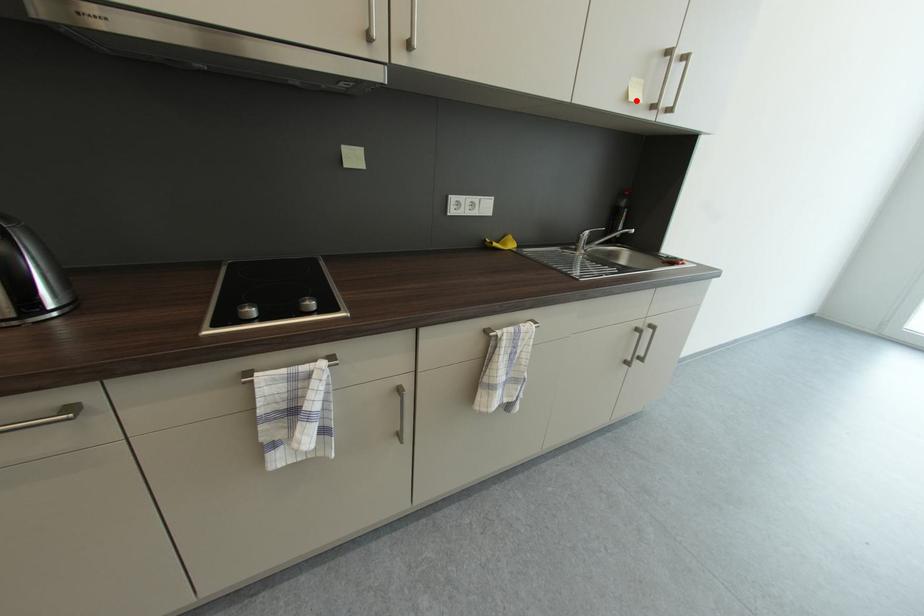
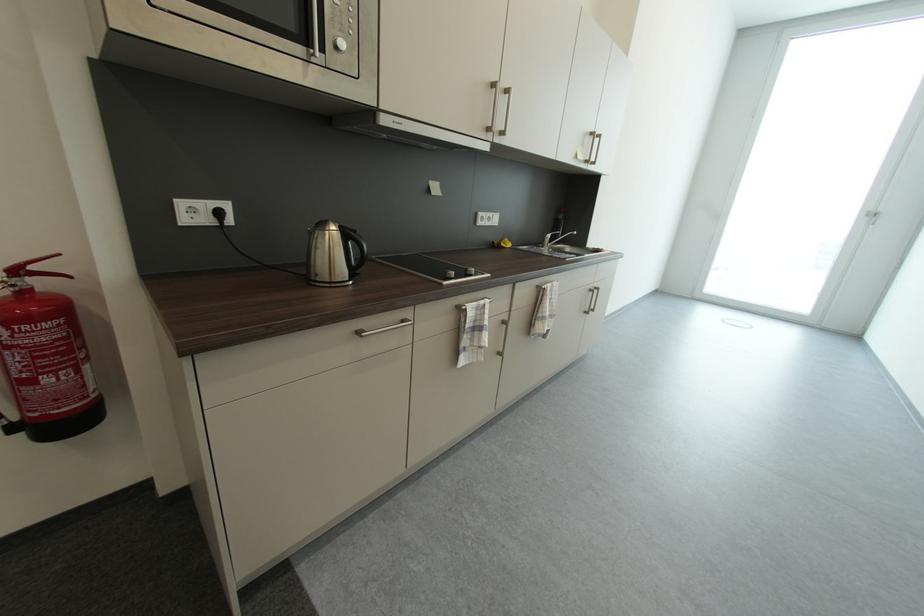
Locate, in the second image, the point that corresponds to the highlighted location in the first image.

(585, 160)